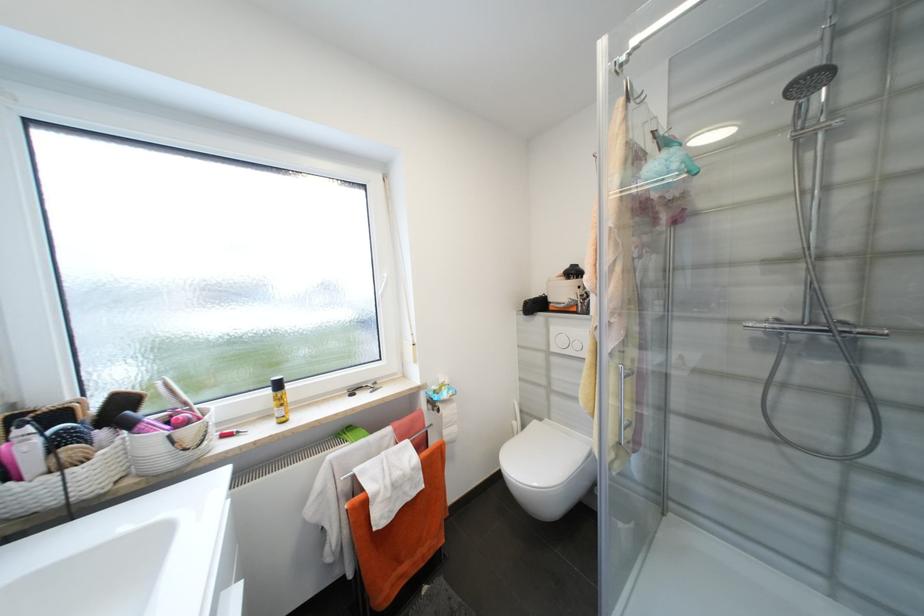
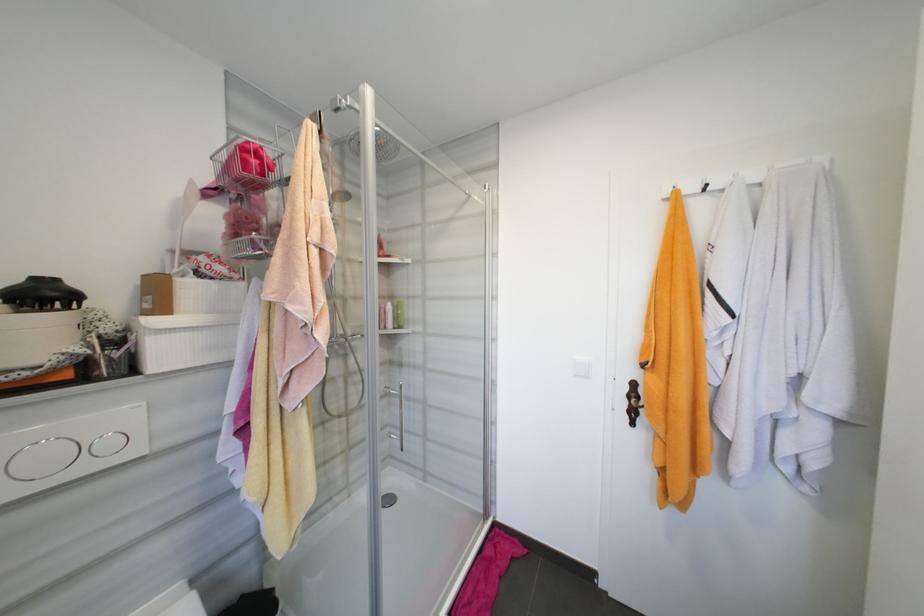
Question: Based on the continuous images, in which direction is the camera rotating? Reply with the corresponding letter.

Choices:
 (A) Left
 (B) Right
 (C) Up
 (D) Down

Answer: (B)